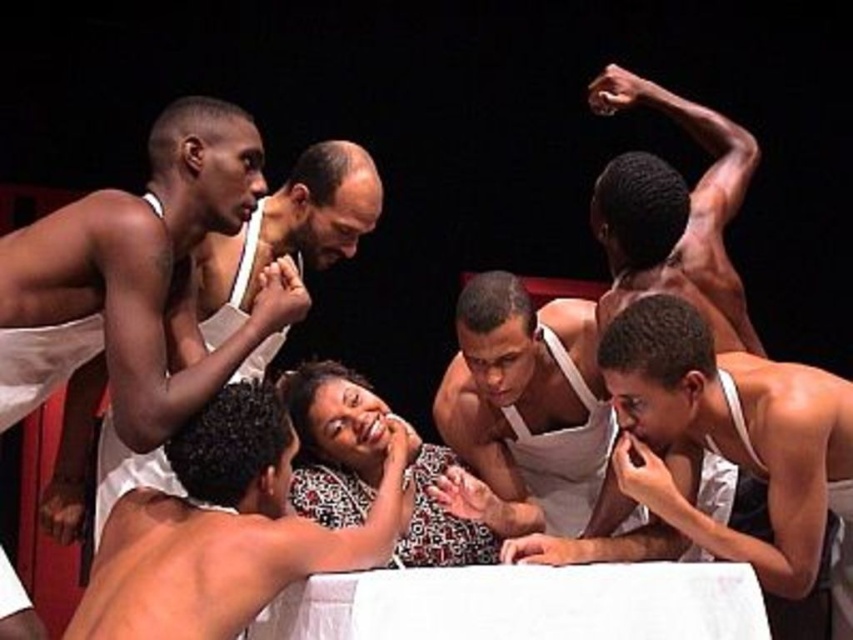
Question: Which of the following is the closest to the observer?

Choices:
 (A) (511, 429)
 (B) (221, 248)

Answer: (B)

Question: From the image, what is the correct spatial relationship of smooth skin man at center in relation to patterned fabric blouse at center?

Choices:
 (A) right
 (B) left

Answer: (B)

Question: Is smooth white tank top at center closer to the viewer compared to patterned fabric blouse at center?

Choices:
 (A) no
 (B) yes

Answer: (B)

Question: Which point is closer to the camera?

Choices:
 (A) 364,444
 (B) 334,168

Answer: (A)

Question: Estimate the real-world distances between objects in this image. Which object is farther from the white fabric at upper left?

Choices:
 (A) smooth skin man at center
 (B) smooth white tank top at center
 (C) white fabric tank top at center
 (D) patterned fabric blouse at center

Answer: (C)

Question: Can you confirm if smooth skin man at center is positioned to the left of white fabric at upper left?

Choices:
 (A) yes
 (B) no

Answer: (B)